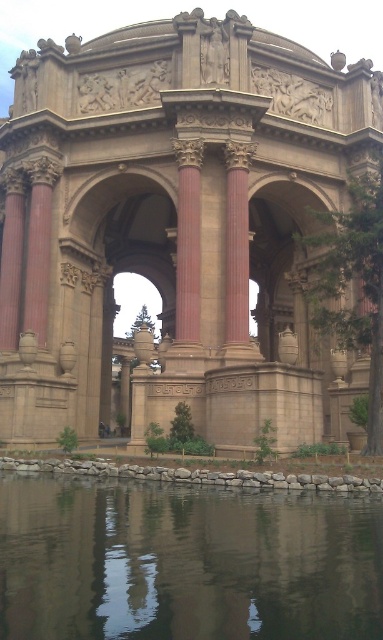
Question: Among these objects, which one is nearest to the camera?

Choices:
 (A) beige stone palace at center
 (B) transparent glass water at lower center

Answer: (B)

Question: Can you confirm if beige stone palace at center is positioned to the left of transparent glass water at lower center?

Choices:
 (A) no
 (B) yes

Answer: (A)

Question: Which of the following is the farthest from the observer?

Choices:
 (A) (315, 220)
 (B) (57, 512)

Answer: (A)

Question: Is beige stone palace at center in front of transparent glass water at lower center?

Choices:
 (A) yes
 (B) no

Answer: (B)

Question: Which point appears closest to the camera in this image?

Choices:
 (A) pyautogui.click(x=181, y=563)
 (B) pyautogui.click(x=68, y=353)

Answer: (A)

Question: Does beige stone palace at center have a larger size compared to transparent glass water at lower center?

Choices:
 (A) no
 (B) yes

Answer: (B)